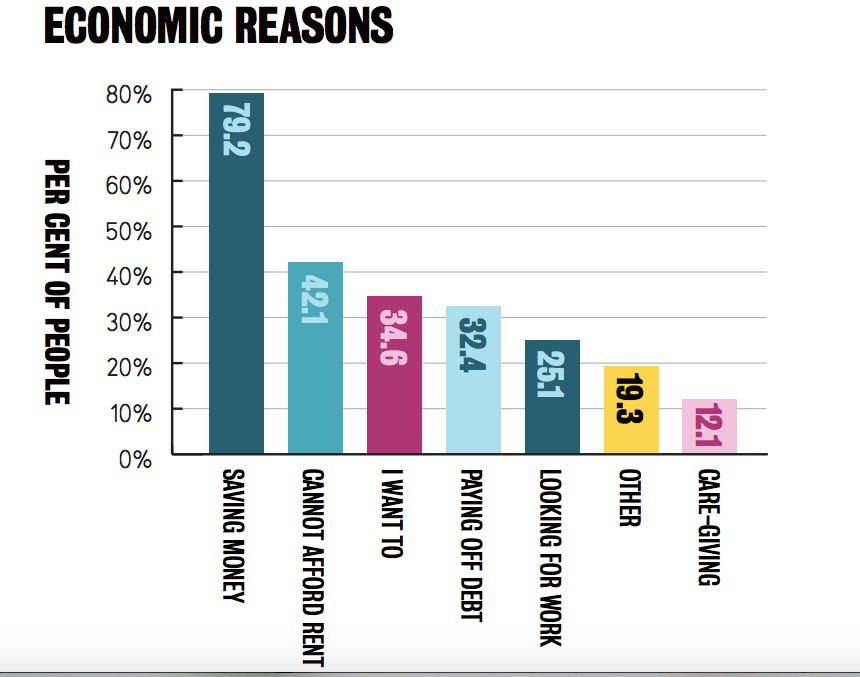
The height and width of the screenshot is (677, 860). I want to click on bar, so click(711, 449).